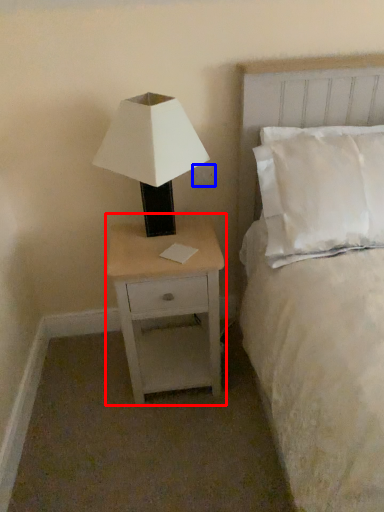
Question: Which of the following is the farthest to the observer, nightstand (highlighted by a red box) or electric outlet (highlighted by a blue box)?

Choices:
 (A) nightstand
 (B) electric outlet

Answer: (B)